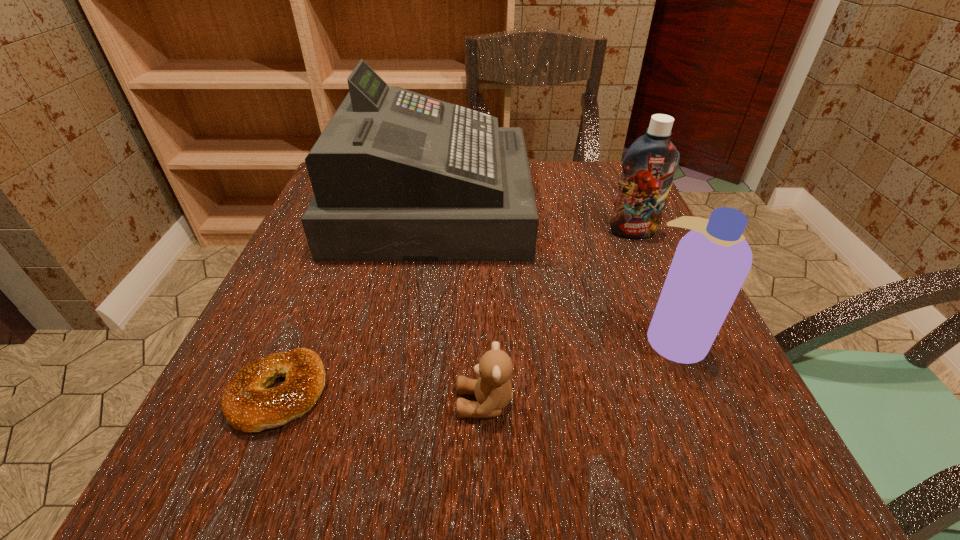
Locate an element on the screen. The width and height of the screenshot is (960, 540). vacant space at the left edge of the desktop is located at coordinates (280, 267).

I want to click on vacant space at the right edge of the desktop, so click(x=635, y=239).

Identify the location of vacant space at the near left corner. (276, 484).

In the image, there is a desktop. Identify the location of vacant space at the far right corner. click(612, 202).

The image size is (960, 540). Find the location of `free space between the nearer shampoo and the cash register`. free space between the nearer shampoo and the cash register is located at coordinates tap(553, 272).

At what (x,y) coordinates should I click in order to perform the action: click on vacant region between the shortest object and the farther shampoo. Please return your answer as a coordinate pair (x, y). The height and width of the screenshot is (540, 960). Looking at the image, I should click on (456, 312).

Locate an element on the screen. The image size is (960, 540). vacant space that is in between the teddy bear and the cash register is located at coordinates (459, 305).

Locate an element on the screen. Image resolution: width=960 pixels, height=540 pixels. vacant space that's between the teddy bear and the nearer shampoo is located at coordinates (579, 370).

Identify the location of empty space between the bagel and the cash register. (356, 299).

This screenshot has width=960, height=540. In order to click on free area in between the fourth tallest object and the nearer shampoo in this screenshot , I will do `click(579, 370)`.